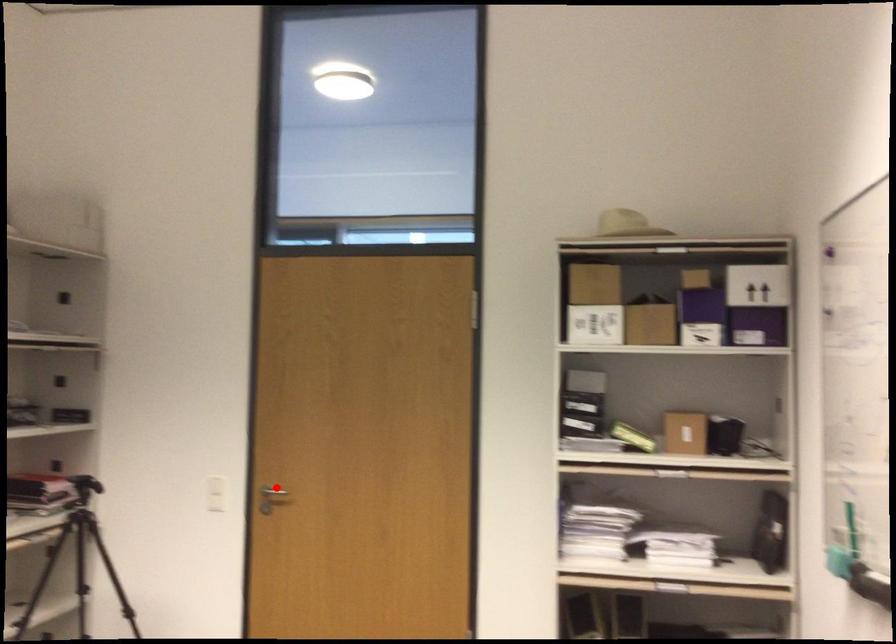
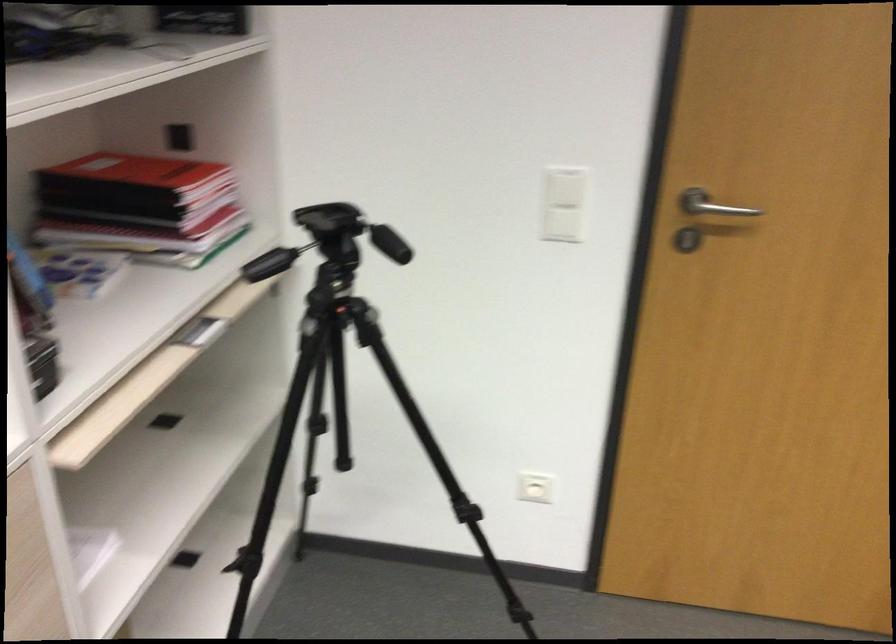
Locate, in the second image, the point that corresponds to the highlighted location in the first image.

(711, 205)